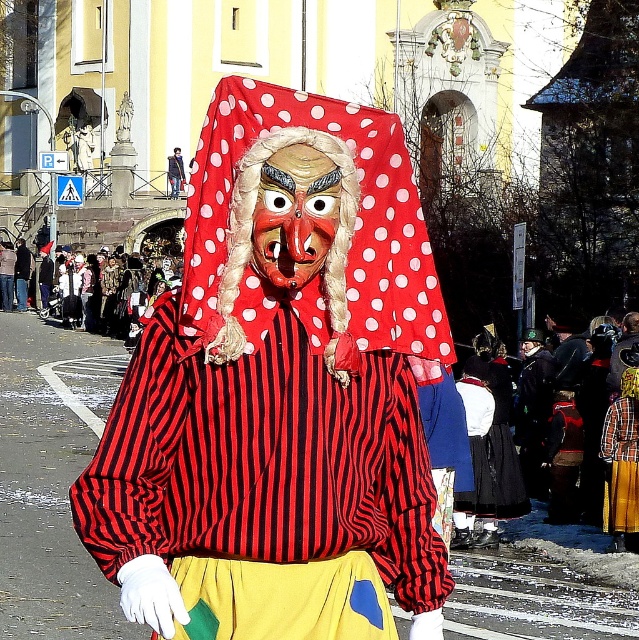
You are an artist trying to sketch the scene. You notice two masks on the central figure. Which mask is wider? The matte red polka dot mask at center or the polished wood mask at center?

The matte red polka dot mask at center is wider than the polished wood mask at center.

You are an artist trying to create a replica of the mask worn by the central figure in the scene. You have two masks in front of you, the matte red polka dot mask at center and the polished wood mask at center. Which mask should you focus on replicating if you want to match the size of the mask covering the person?

The matte red polka dot mask at center has a larger size compared to the polished wood mask at center, so you should focus on replicating the matte red polka dot mask at center to match the size of the mask covering the person.

You are a photographer standing at the center of the street scene. You want to take a photo that includes both point (346, 333) and point (296, 141). Which point will appear closer to the front of the photo?

Point (346, 333) is further to the camera than point (296, 141), so in the photo, point (346, 333) will appear closer to the front of the photo.